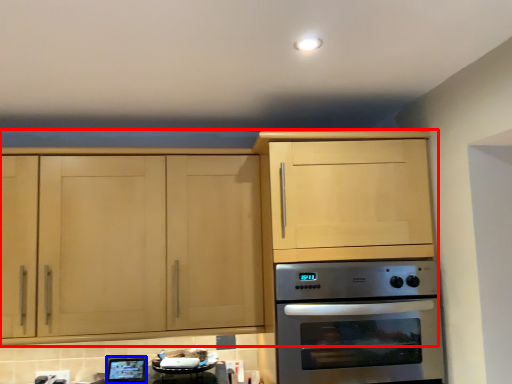
Question: Which object appears farthest to the camera in this image, cabinetry (highlighted by a red box) or appliance (highlighted by a blue box)?

Choices:
 (A) cabinetry
 (B) appliance

Answer: (B)